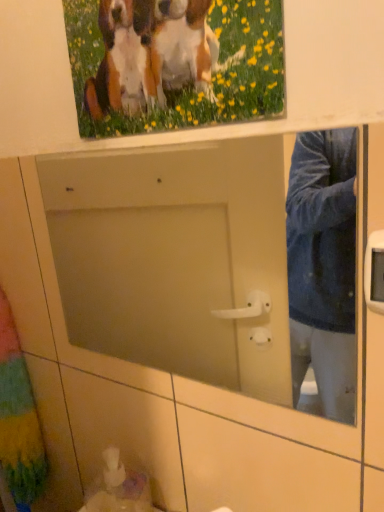
Question: From a real-world perspective, is white glossy sink at lower left positioned above or below multicolored fabric curtain at left?

Choices:
 (A) below
 (B) above

Answer: (A)

Question: Do you think white glossy sink at lower left is within multicolored fabric curtain at left, or outside of it?

Choices:
 (A) inside
 (B) outside

Answer: (B)

Question: Which of these objects is positioned farthest from the multicolored fabric curtain at left?

Choices:
 (A) wooden picture frame at upper center
 (B) white glossy sink at lower left

Answer: (A)

Question: Which object is positioned closest to the wooden picture frame at upper center?

Choices:
 (A) white glossy sink at lower left
 (B) multicolored fabric curtain at left

Answer: (A)